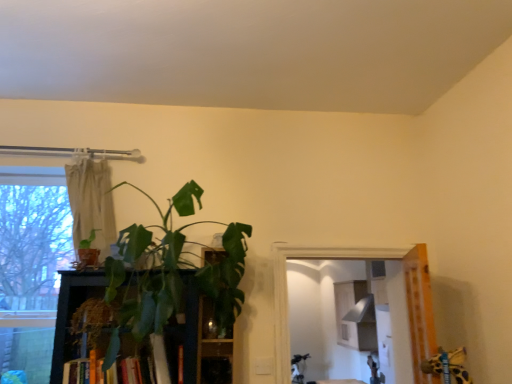
The height and width of the screenshot is (384, 512). What do you see at coordinates (213, 347) in the screenshot?
I see `green leafy plant at center` at bounding box center [213, 347].

This screenshot has height=384, width=512. In order to click on beige fabric curtain at upper left in this screenshot , I will do `click(91, 203)`.

From the picture: Is there a large distance between hardcover book at center and green matte plant at left, positioned as the first houseplant in left-to-right order?

That's not correct — hardcover book at center is a little close to green matte plant at left, positioned as the first houseplant in left-to-right order.

The image size is (512, 384). In order to click on book to the right of green matte plant at left, positioned as the first houseplant in left-to-right order in this screenshot , I will do [106, 372].

Is point (162, 365) closer or farther from the camera than point (81, 251)?

Point (162, 365) is closer to the camera than point (81, 251).

You are a GUI agent. You are given a task and a screenshot of the screen. Output one action in this format:
    pyautogui.click(x=<x>, y=<y>)
    Task: Click on the 2nd houseplant below the beige fabric curtain at upper left (from the image's perspective)
    Image resolution: width=512 pixels, height=384 pixels.
    Given the screenshot: What is the action you would take?
    pyautogui.click(x=170, y=272)

Can you confirm if beige fabric curtain at upper left is positioned to the right of green leafy plant at center, which is the 2th houseplant from left to right?

Incorrect, beige fabric curtain at upper left is not on the right side of green leafy plant at center, which is the 2th houseplant from left to right.

Is green leafy plant at center, which is the 2th houseplant from left to right, located within beige fabric curtain at upper left?

No, green leafy plant at center, which is the 2th houseplant from left to right, is located outside of beige fabric curtain at upper left.

In terms of size, does beige fabric curtain at upper left appear bigger or smaller than green leafy plant at center, which is the 2th houseplant from left to right?

In the image, beige fabric curtain at upper left appears to be smaller than green leafy plant at center, which is the 2th houseplant from left to right.

Choose the correct answer: Is green leafy plant at center, which is the 2th houseplant from left to right, inside green leafy plant at center or outside it?

green leafy plant at center, which is the 2th houseplant from left to right, is not inside green leafy plant at center, it's outside.

Does green leafy plant at center, which is the first houseplant in right-to-left order, have a larger size compared to green leafy plant at center?

Yes.

Is green leafy plant at center, which is the 2th houseplant from left to right, wider or thinner than green leafy plant at center?

green leafy plant at center, which is the 2th houseplant from left to right, is wider than green leafy plant at center.

Is green matte plant at left, positioned as the first houseplant in left-to-right order, spatially inside green leafy plant at center, or outside of it?

green matte plant at left, positioned as the first houseplant in left-to-right order, is not inside green leafy plant at center, it's outside.

Is green matte plant at left, positioned as the first houseplant in left-to-right order, directly adjacent to green leafy plant at center?

No, green matte plant at left, positioned as the first houseplant in left-to-right order, is not next to green leafy plant at center.

Between point (86, 248) and point (205, 253), which one is positioned behind?

Point (205, 253)

Between green matte plant at left, positioned as the first houseplant in left-to-right order, and green leafy plant at center, which one has smaller size?

With smaller size is green matte plant at left, positioned as the first houseplant in left-to-right order.

Is beige fabric curtain at upper left far from hardcover book at center?

They are positioned close to each other.

Considering the relative sizes of beige fabric curtain at upper left and hardcover book at center in the image provided, is beige fabric curtain at upper left thinner than hardcover book at center?

Indeed, beige fabric curtain at upper left has a lesser width compared to hardcover book at center.

From the image's perspective, who appears lower, beige fabric curtain at upper left or hardcover book at center?

From the image's view, hardcover book at center is below.

Which object is further away from the camera taking this photo, beige fabric curtain at upper left or hardcover book at center?

Positioned behind is beige fabric curtain at upper left.

Is green matte plant at left, positioned as the first houseplant in left-to-right order, shorter than beige fabric curtain at upper left?

Indeed, green matte plant at left, positioned as the first houseplant in left-to-right order, has a lesser height compared to beige fabric curtain at upper left.

Which is more distant, (93, 260) or (106, 185)?

Positioned behind is point (106, 185).

From the image's perspective, does green matte plant at left, the 2th houseplant positioned from the right, appear higher than beige fabric curtain at upper left?

No, from the image's perspective, green matte plant at left, the 2th houseplant positioned from the right, is not on top of beige fabric curtain at upper left.

Is green matte plant at left, the 2th houseplant positioned from the right, at the left side of beige fabric curtain at upper left?

No, green matte plant at left, the 2th houseplant positioned from the right, is not to the left of beige fabric curtain at upper left.

Would you say green matte plant at left, positioned as the first houseplant in left-to-right order, is outside hardcover book at center?

That's correct, green matte plant at left, positioned as the first houseplant in left-to-right order, is outside of hardcover book at center.

Could you measure the distance between green matte plant at left, positioned as the first houseplant in left-to-right order, and hardcover book at center?

The distance of green matte plant at left, positioned as the first houseplant in left-to-right order, from hardcover book at center is 20.37 inches.

Is green matte plant at left, positioned as the first houseplant in left-to-right order, aimed at hardcover book at center?

No, green matte plant at left, positioned as the first houseplant in left-to-right order, is not facing towards hardcover book at center.

Based on their positions, is green matte plant at left, positioned as the first houseplant in left-to-right order, located to the left or right of hardcover book at center?

Based on their positions, green matte plant at left, positioned as the first houseplant in left-to-right order, is located to the left of hardcover book at center.

Identify the location of book that is in front of the green matte plant at left, positioned as the first houseplant in left-to-right order. The image size is (512, 384). (106, 372).

The width and height of the screenshot is (512, 384). In order to click on curtain located above the green leafy plant at center, which is the first houseplant in right-to-left order (from a real-world perspective) in this screenshot , I will do `click(91, 203)`.

When comparing their distances from green leafy plant at center, which is the 2th houseplant from left to right, does beige fabric curtain at upper left or green matte plant at left, positioned as the first houseplant in left-to-right order, seem closer?

The object closer to green leafy plant at center, which is the 2th houseplant from left to right, is beige fabric curtain at upper left.

Based on their spatial positions, is beige fabric curtain at upper left or green matte plant at left, positioned as the first houseplant in left-to-right order, closer to hardcover book at center?

The object closer to hardcover book at center is green matte plant at left, positioned as the first houseplant in left-to-right order.

Looking at the image, which one is located closer to green matte plant at left, the 2th houseplant positioned from the right, green leafy plant at center, which is the first houseplant in right-to-left order, or hardcover book at center?

green leafy plant at center, which is the first houseplant in right-to-left order, lies closer to green matte plant at left, the 2th houseplant positioned from the right, than the other object.

Considering their positions, is hardcover book at center positioned further to beige fabric curtain at upper left than green matte plant at left, the 2th houseplant positioned from the right?

hardcover book at center.

When comparing their distances from green leafy plant at center, which is the first houseplant in right-to-left order, does green matte plant at left, positioned as the first houseplant in left-to-right order, or beige fabric curtain at upper left seem further?

green matte plant at left, positioned as the first houseplant in left-to-right order, lies further to green leafy plant at center, which is the first houseplant in right-to-left order, than the other object.

Based on their spatial positions, is green leafy plant at center, which is the first houseplant in right-to-left order, or green leafy plant at center closer to beige fabric curtain at upper left?

Among the two, green leafy plant at center, which is the first houseplant in right-to-left order, is located nearer to beige fabric curtain at upper left.

Based on their spatial positions, is hardcover book at center or green matte plant at left, positioned as the first houseplant in left-to-right order, closer to green leafy plant at center, which is the 2th houseplant from left to right?

Among the two, hardcover book at center is located nearer to green leafy plant at center, which is the 2th houseplant from left to right.

Which object lies further to the anchor point green leafy plant at center, which is the first houseplant in right-to-left order, beige fabric curtain at upper left or green leafy plant at center?

Based on the image, beige fabric curtain at upper left appears to be further to green leafy plant at center, which is the first houseplant in right-to-left order.

At what (x,y) coordinates should I click in order to perform the action: click on book positioned between green leafy plant at center, which is the first houseplant in right-to-left order, and green leafy plant at center from near to far. Please return your answer as a coordinate pair (x, y). The height and width of the screenshot is (384, 512). Looking at the image, I should click on (106, 372).

Where is `shelf between beige fabric curtain at upper left and hardcover book at center in the vertical direction`? shelf between beige fabric curtain at upper left and hardcover book at center in the vertical direction is located at coordinates (213, 347).

Locate an element on the screen. houseplant between green leafy plant at center, which is the 2th houseplant from left to right, and beige fabric curtain at upper left from front to back is located at coordinates (87, 253).

At what (x,y) coordinates should I click in order to perform the action: click on houseplant between green matte plant at left, the 2th houseplant positioned from the right, and green leafy plant at center from left to right. Please return your answer as a coordinate pair (x, y). Looking at the image, I should click on (170, 272).